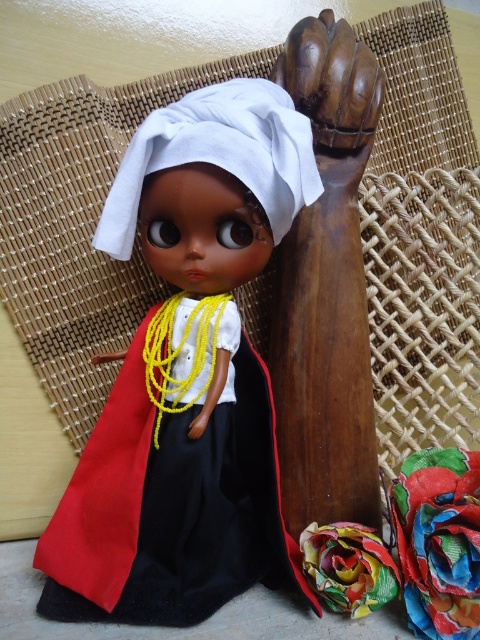
Is matte black dress at center positioned behind wooden hand at center?

No, it is not.

Measure the distance between matte black dress at center and camera.

matte black dress at center and camera are 38.16 inches apart.

Find the location of a particular element. matte black dress at center is located at coordinates (187, 372).

Does matte black dress at center appear on the right side of multicolored fabric at lower right?

Incorrect, matte black dress at center is not on the right side of multicolored fabric at lower right.

What do you see at coordinates (187, 372) in the screenshot? I see `matte black dress at center` at bounding box center [187, 372].

Identify the location of matte black dress at center. (187, 372).

Is white cotton cloth at center wider than wooden hand at center?

Yes.

Is white cotton cloth at center shorter than wooden hand at center?

Incorrect, white cotton cloth at center's height does not fall short of wooden hand at center's.

Does point (172, 145) come farther from viewer compared to point (196, 433)?

No, (172, 145) is in front of (196, 433).

Where is `white cotton cloth at center`? white cotton cloth at center is located at coordinates (218, 154).